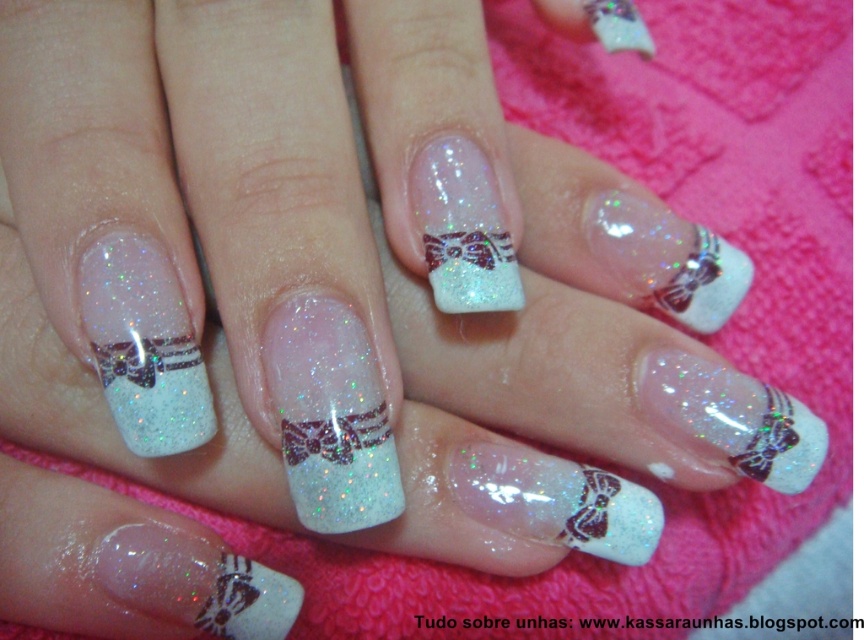
Question: Among these objects, which one is farthest from the camera?

Choices:
 (A) glittery white nail at center
 (B) glittery metallic bow at center

Answer: (A)

Question: Is glittery white nail at center below glittery metallic bow at center?

Choices:
 (A) yes
 (B) no

Answer: (B)

Question: Does glittery white nail at center appear over glittery metallic bow at center?

Choices:
 (A) yes
 (B) no

Answer: (A)

Question: Does glittery white nail at center appear over glittery metallic bow at center?

Choices:
 (A) no
 (B) yes

Answer: (B)

Question: Which object is closer to the camera taking this photo?

Choices:
 (A) glittery white nail at center
 (B) glittery metallic bow at center

Answer: (B)